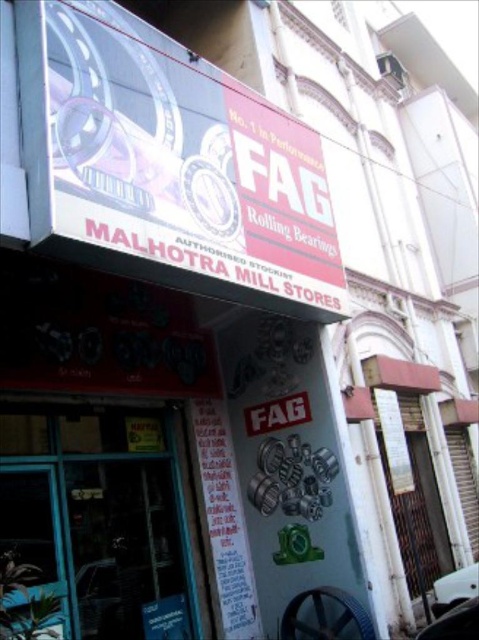
You are a customer entering the store and notice two items at the center of the entrance. You want to know which one is narrower. Which object is narrower between the white paper at center and the white matte signboard at center?

The white paper at center is narrower than the white matte signboard at center because its width is less than the signboard.

You are a customer standing outside the store looking at the storefront. There is a point at coordinates (183, 164). What object is located at that point?

The point at coordinates (183, 164) indicates a white glossy signboard at upper center.

You are a customer standing at the entrance of Malhotra Mill Stores. You see a white paper at center and a white matte signboard at center. If you want to read both items, which one should you move towards first to read the one that is closer to you?

Both the white paper at center and the white matte signboard at center are at the same distance from you since they are both at the center, so you can choose either one first.